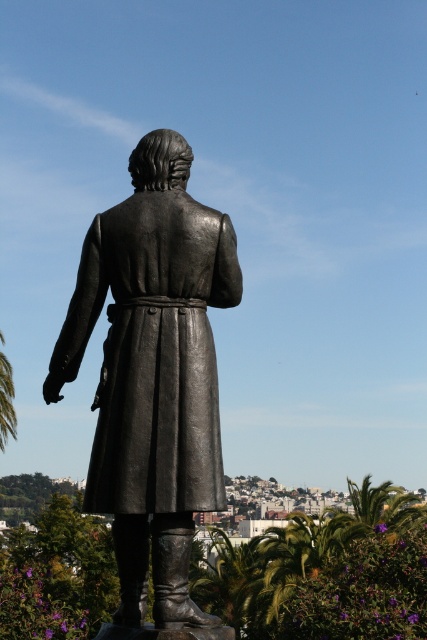
Question: Is polished bronze statue at center to the left of green leafy palm tree at lower left from the viewer's perspective?

Choices:
 (A) yes
 (B) no

Answer: (B)

Question: Can you confirm if polished bronze statue at center is bigger than green leafy palm tree at lower left?

Choices:
 (A) no
 (B) yes

Answer: (A)

Question: Does polished bronze statue at center appear under green leafy palm tree at lower left?

Choices:
 (A) yes
 (B) no

Answer: (B)

Question: Which of the following is the closest to the observer?

Choices:
 (A) polished bronze statue at center
 (B) green leafy palm tree at lower left

Answer: (A)